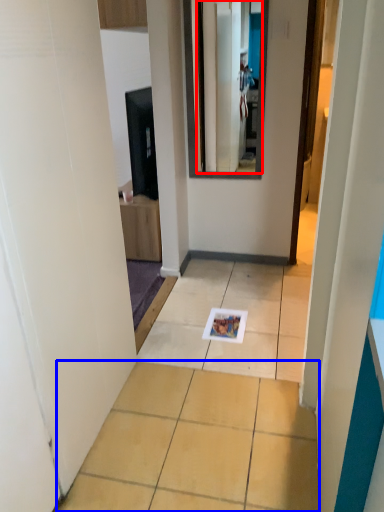
Question: Which point is further to the camera, mirror (highlighted by a red box) or ceramic tile (highlighted by a blue box)?

Choices:
 (A) mirror
 (B) ceramic tile

Answer: (A)